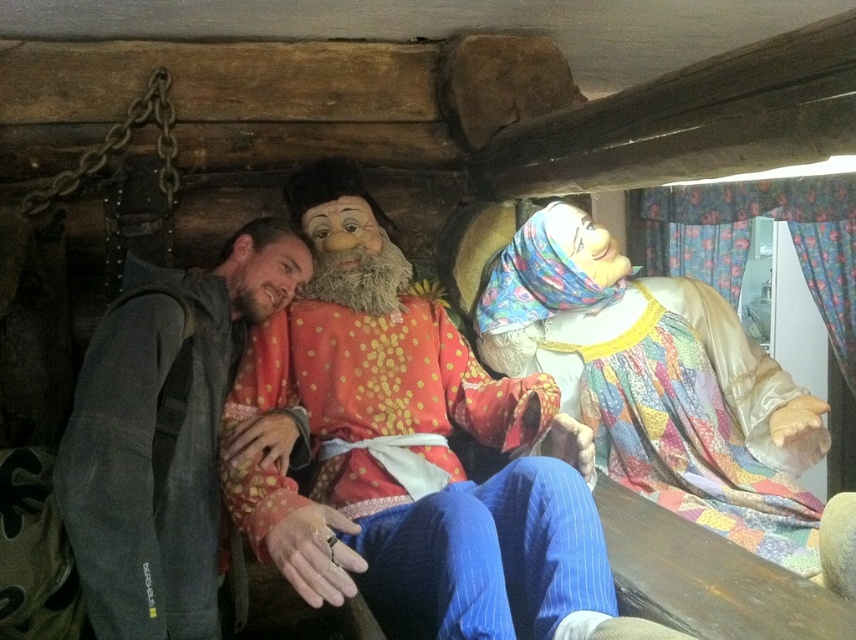
You are a photographer setting up a shoot inside the rustic cabin. You need to position the multicolored fabric dress at upper right and the gray fabric jacket at left in a way that the shorter one is placed in the front to avoid blocking the view. Which object should be placed in front?

The multicolored fabric dress at upper right should be placed in front since it has a lesser height compared to the gray fabric jacket at left.

You are a photographer standing in the cabin and want to capture a photo of both the red velvet robe at center and the multicolored fabric dress at upper right in the same frame. Which object should you focus on first to ensure both are in the frame?

The red velvet robe at center is located below the multicolored fabric dress at upper right. To capture both in the same frame, focus on the multicolored fabric dress at upper right first as it is higher up, allowing the camera to include the lower positioned red velvet robe at center in the shot.

You are a costume designer who needs to adjust the length of the red velvet robe at center and the gray fabric jacket at left so that they are the same height. Which costume should you lengthen or shorten, and by how much?

The red velvet robe at center is shorter than the gray fabric jacket at left. To make them the same height, you should lengthen the red velvet robe at center by the difference in their lengths or shorten the gray fabric jacket at left by the same amount.